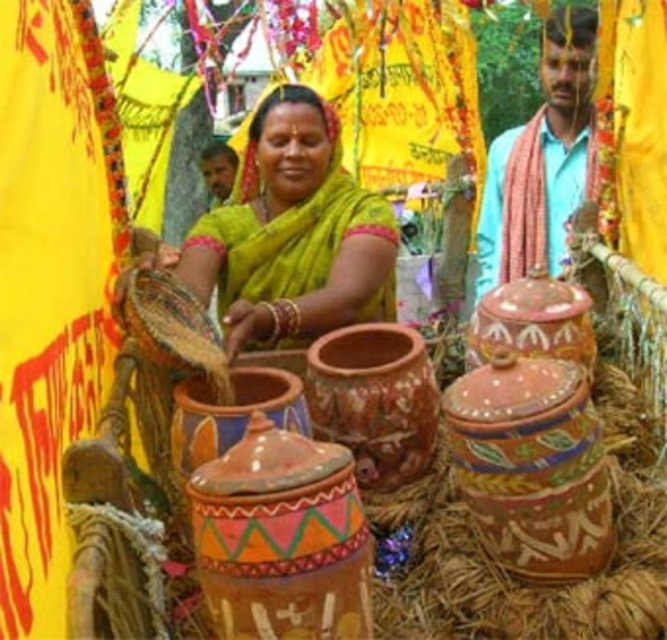
Does terracotta pot at center lie in front of terracotta jar at center?

Yes, terracotta pot at center is closer to the viewer.

Between terracotta pot at center and terracotta jar at center, which one has less height?

With less height is terracotta jar at center.

Is point (400, 349) less distant than point (540, 276)?

No, it is behind (540, 276).

Find the location of `terracotta pot at center`. terracotta pot at center is located at coordinates (374, 400).

Which is in front, point (526, 296) or point (221, 200)?

Positioned in front is point (526, 296).

Between point (500, 344) and point (215, 177), which one is positioned in front?

Point (500, 344) is in front.

Where is `terracotta jar at center`? The height and width of the screenshot is (640, 667). terracotta jar at center is located at coordinates (534, 321).

Is matte yellow saree at center smaller than multicolored painted jar at center?

Incorrect, matte yellow saree at center is not smaller in size than multicolored painted jar at center.

Who is more distant from viewer, (x=275, y=120) or (x=231, y=605)?

Point (x=275, y=120)

Between point (386, 225) and point (237, 496), which one is positioned in front?

Point (237, 496)

You are a GUI agent. You are given a task and a screenshot of the screen. Output one action in this format:
    pyautogui.click(x=<x>, y=<y>)
    Task: Click on the matte yellow saree at center
    The width and height of the screenshot is (667, 640).
    Given the screenshot: What is the action you would take?
    pyautogui.click(x=293, y=234)